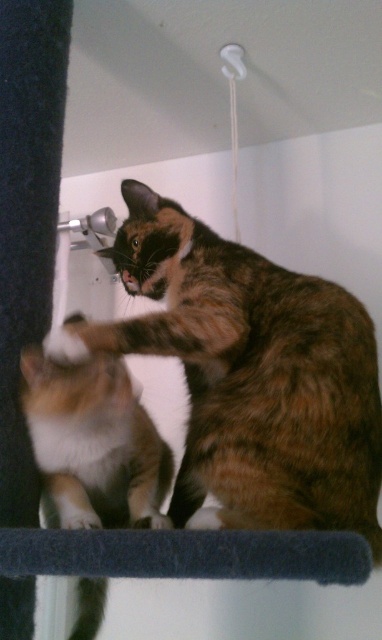
You are a cat owner trying to separate two cats in your bathroom. You see the calico fur cat at center and the calico fur cat at lower left. Which cat should you approach first to avoid startling them?

You should approach the calico fur cat at center first because it is closer to you than the calico fur cat at lower left, making it easier to reach without startling them.

You are a cat owner who wants to ensure both cats have enough space on their cat tree. Given that the dark blue textured surface is 30 cm tall, can both calico fur cat at center and calico fur cat at lower left fit vertically on it without overlapping?

The calico fur cat at center is taller than calico fur cat at lower left. Since the dark blue textured surface is 30 cm tall, the taller cat may not fit comfortably if its height exceeds 30 cm. The shorter cat would likely fit, but the taller one might not. Check the actual height of both cats to confirm.